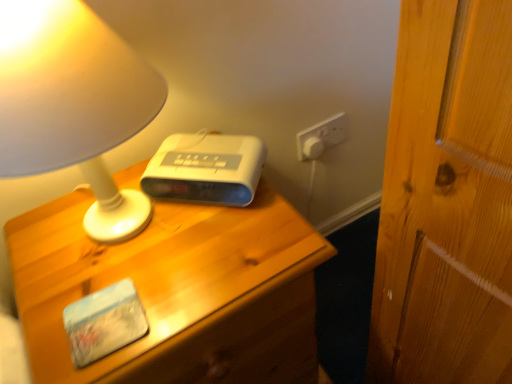
Question: Is white plastic alarm clock at center not within wooden nightstand at center?

Choices:
 (A) yes
 (B) no

Answer: (A)

Question: Considering the relative sizes of white plastic alarm clock at center and wooden nightstand at center in the image provided, is white plastic alarm clock at center taller than wooden nightstand at center?

Choices:
 (A) yes
 (B) no

Answer: (B)

Question: Does white plastic alarm clock at center come behind wooden nightstand at center?

Choices:
 (A) no
 (B) yes

Answer: (B)

Question: Does white plastic alarm clock at center come in front of wooden nightstand at center?

Choices:
 (A) yes
 (B) no

Answer: (B)

Question: From the image's perspective, is white plastic alarm clock at center located above wooden nightstand at center?

Choices:
 (A) yes
 (B) no

Answer: (A)

Question: From the image's perspective, is white plastic alarm clock at center above or below wooden nightstand at center?

Choices:
 (A) above
 (B) below

Answer: (A)

Question: Visually, is white plastic alarm clock at center positioned to the left or to the right of wooden nightstand at center?

Choices:
 (A) right
 (B) left

Answer: (A)

Question: In terms of size, does white plastic alarm clock at center appear bigger or smaller than wooden nightstand at center?

Choices:
 (A) small
 (B) big

Answer: (A)

Question: In the image, is white plastic alarm clock at center positioned in front of or behind wooden nightstand at center?

Choices:
 (A) behind
 (B) front

Answer: (A)

Question: Does point (84, 76) appear closer or farther from the camera than point (224, 155)?

Choices:
 (A) closer
 (B) farther

Answer: (A)

Question: Is matte white lamp at upper left inside or outside of white plastic alarm clock at center?

Choices:
 (A) inside
 (B) outside

Answer: (B)

Question: From a real-world perspective, relative to white plastic alarm clock at center, is matte white lamp at upper left vertically above or below?

Choices:
 (A) above
 (B) below

Answer: (A)

Question: From the image's perspective, relative to white plastic alarm clock at center, is matte white lamp at upper left above or below?

Choices:
 (A) above
 (B) below

Answer: (A)

Question: Considering their positions, is matte white lamp at upper left located in front of or behind wooden nightstand at center?

Choices:
 (A) front
 (B) behind

Answer: (A)

Question: From a real-world perspective, is matte white lamp at upper left physically located above or below wooden nightstand at center?

Choices:
 (A) above
 (B) below

Answer: (A)